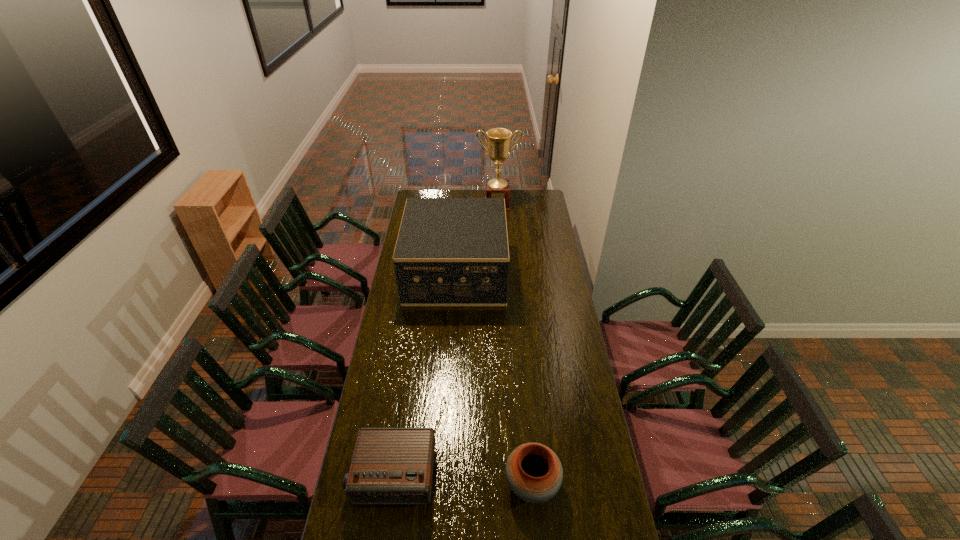
Find the location of a particular element. Image resolution: width=960 pixels, height=540 pixels. trophy cup is located at coordinates (499, 139).

Locate an element on the screen. the tallest object is located at coordinates (499, 139).

This screenshot has width=960, height=540. I want to click on the third nearest object, so tap(450, 251).

Identify the location of box. (450, 251).

Locate an element on the screen. The width and height of the screenshot is (960, 540). pottery is located at coordinates (534, 473).

Where is `radio receiver`? radio receiver is located at coordinates pos(389,465).

Find the location of a particular element. vacant region located on the plaque of the tallest object is located at coordinates (499, 240).

Locate an element on the screen. The image size is (960, 540). free space located on the front-facing side of the box is located at coordinates (558, 272).

Identify the location of free space located on the back of the pottery. (525, 401).

The height and width of the screenshot is (540, 960). Identify the location of vacant space situated 0.070m on the front panel of the radio receiver. (385, 531).